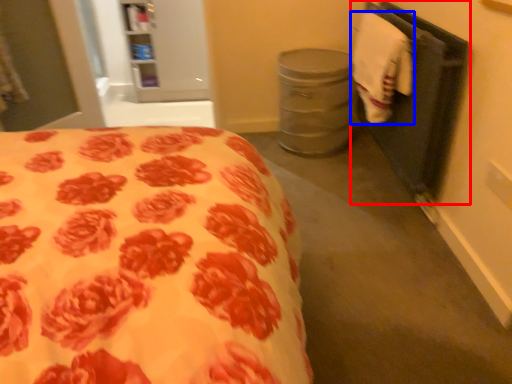
Question: Which point is further to the camera, closet (highlighted by a red box) or hand towel (highlighted by a blue box)?

Choices:
 (A) closet
 (B) hand towel

Answer: (B)